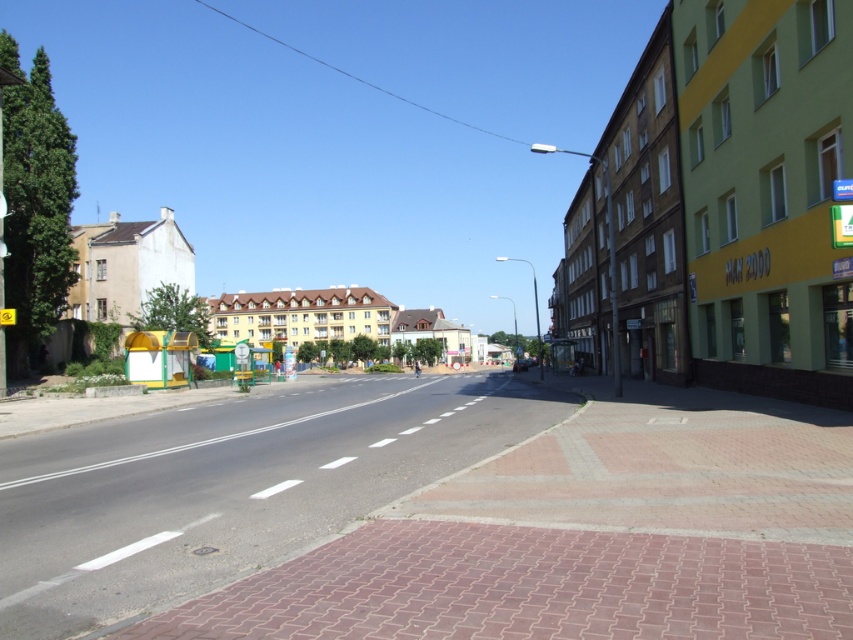
Who is more forward, [793,16] or [357,292]?

Point [793,16] is more forward.

Is green painted building at right closer to the viewer compared to beige concrete building at left?

Yes, it is.

Does point (746, 216) come in front of point (277, 326)?

Yes, point (746, 216) is in front of point (277, 326).

Find the location of a particular element. This screenshot has width=853, height=640. green painted building at right is located at coordinates (735, 198).